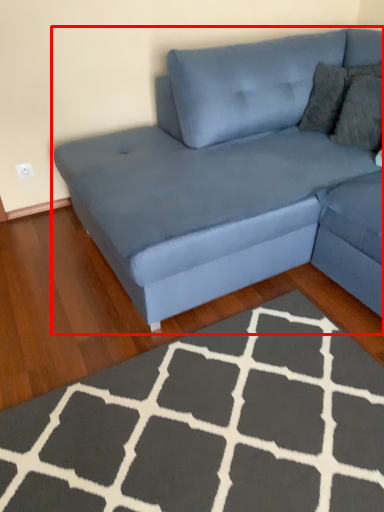
Question: From the image, what is the correct spatial relationship of studio couch (annotated by the red box) in relation to doormat?

Choices:
 (A) left
 (B) right

Answer: (B)